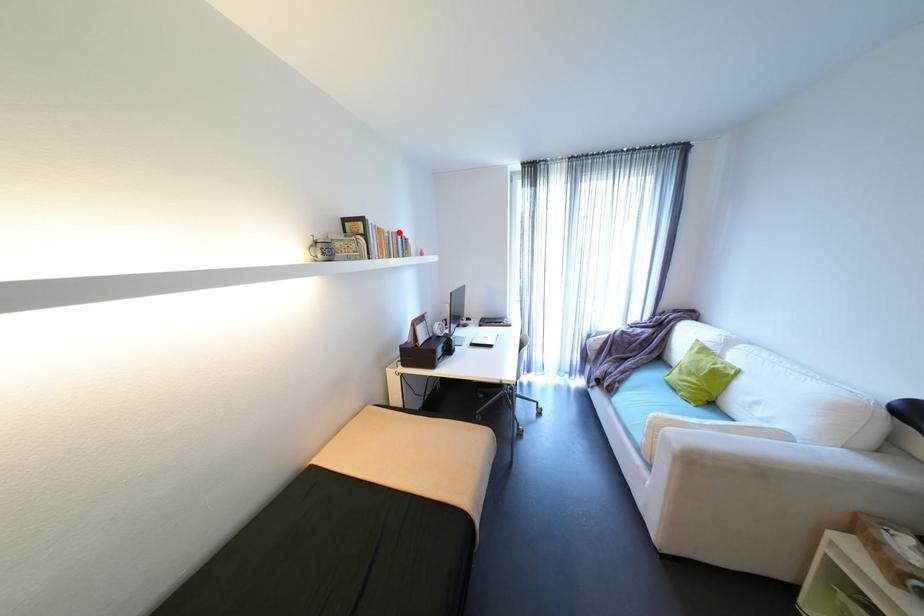
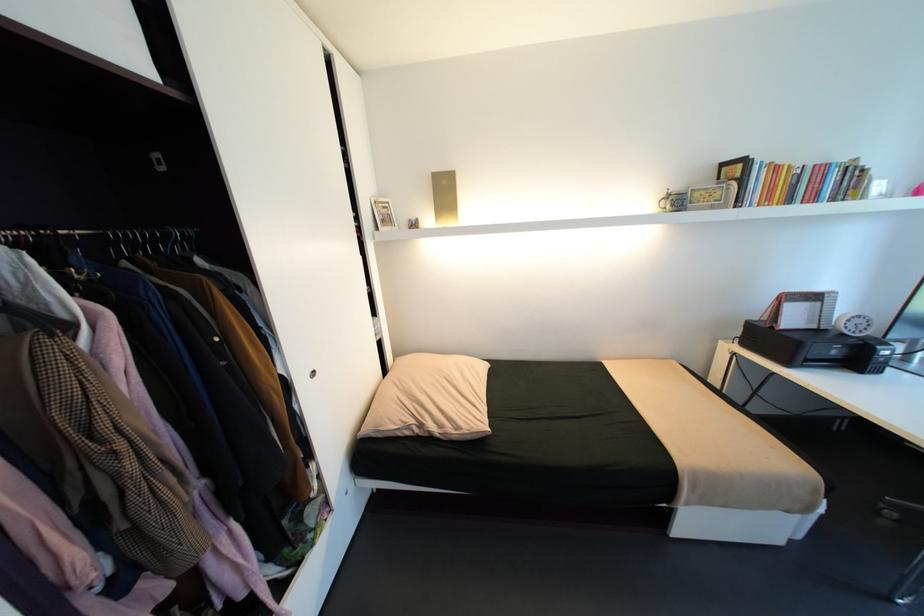
Where in the second image is the point corresponding to the highlighted location from the first image?

(821, 166)